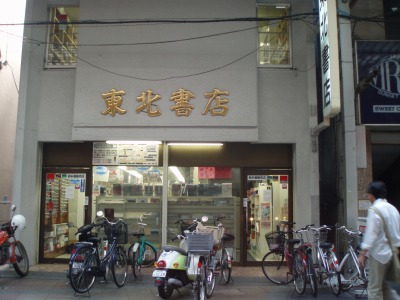
Where is `doorway`? doorway is located at coordinates (245, 210).